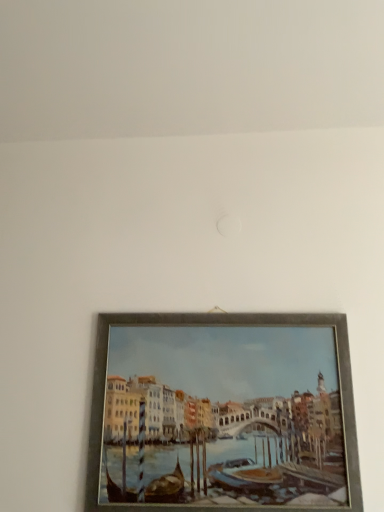
Image resolution: width=384 pixels, height=512 pixels. Describe the element at coordinates (222, 413) in the screenshot. I see `metallic silver picture frame at lower center` at that location.

Identify the location of metallic silver picture frame at lower center. This screenshot has height=512, width=384. (222, 413).

I want to click on metallic silver picture frame at lower center, so click(x=222, y=413).